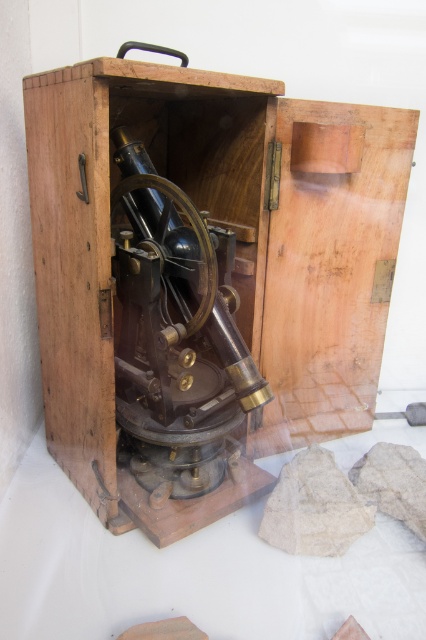
Is the position of wooden box at center less distant than that of polished brass telescope at center?

Yes.

Can you confirm if wooden box at center is thinner than polished brass telescope at center?

Incorrect, wooden box at center's width is not less than polished brass telescope at center's.

The width and height of the screenshot is (426, 640). Find the location of `wooden box at center`. wooden box at center is located at coordinates (204, 278).